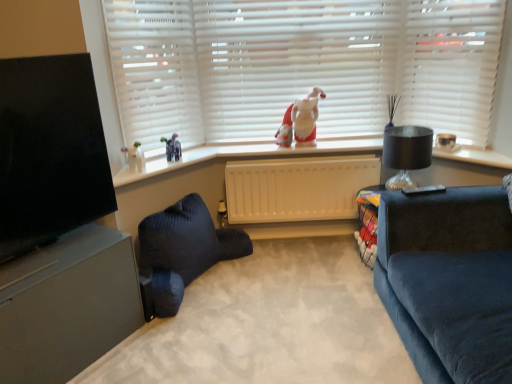
At what (x,y) coordinates should I click in order to perform the action: click on free spot to the right of dark blue fabric studio couch at lower center. Please return your answer as a coordinate pair (x, y). The height and width of the screenshot is (384, 512). Looking at the image, I should click on (293, 294).